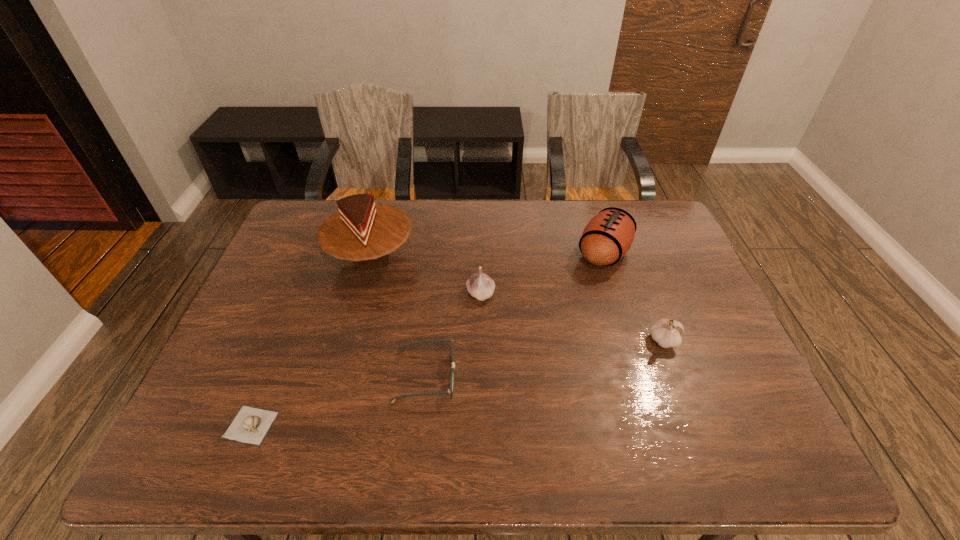
This screenshot has height=540, width=960. I want to click on object present at the near left corner, so click(250, 425).

At what (x,y) coordinates should I click in order to perform the action: click on object present at the far right corner. Please return your answer as a coordinate pair (x, y). The width and height of the screenshot is (960, 540). Looking at the image, I should click on (607, 237).

What are the coordinates of `free location at the far edge of the desktop` in the screenshot? It's located at (446, 202).

This screenshot has height=540, width=960. In order to click on vacant space at the near edge of the desktop in this screenshot , I will do `click(270, 452)`.

Locate an element on the screen. The image size is (960, 540). vacant space at the left edge of the desktop is located at coordinates click(260, 340).

Image resolution: width=960 pixels, height=540 pixels. In the image, there is a desktop. In order to click on free space at the right edge in this screenshot , I will do `click(703, 408)`.

In the image, there is a desktop. What are the coordinates of `free space at the far left corner` in the screenshot? It's located at (287, 226).

You are a GUI agent. You are given a task and a screenshot of the screen. Output one action in this format:
    pyautogui.click(x=<x>, y=<y>)
    Task: Click on the free space between the cake and the football (American)
    
    Given the screenshot: What is the action you would take?
    (x=488, y=255)

At what (x,y) coordinates should I click in order to perform the action: click on free space that is in between the tallest object and the nearest object. Please return your answer as a coordinate pair (x, y). This screenshot has height=540, width=960. Looking at the image, I should click on (311, 341).

At what (x,y) coordinates should I click in order to perform the action: click on free point between the tallest object and the second garlic from right to left. Please return your answer as a coordinate pair (x, y). The image size is (960, 540). Looking at the image, I should click on (426, 275).